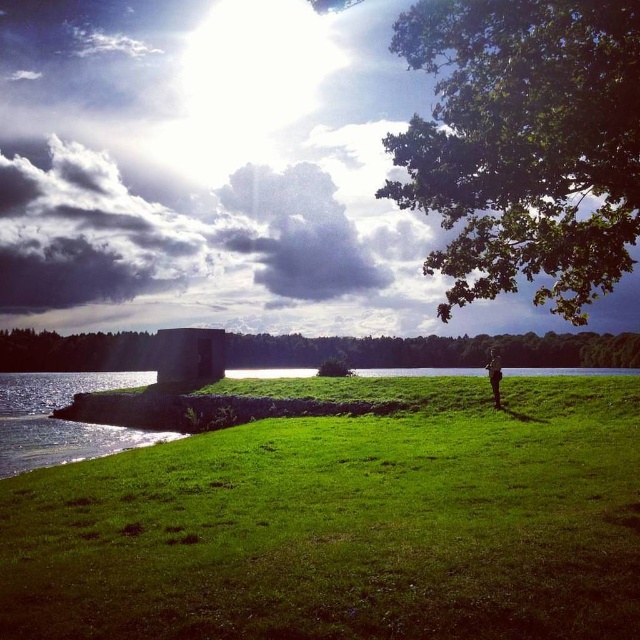
You are a photographer planning to take a landscape photo of the green grassy at center and the green leafy tree at upper right. Based on their heights, which object would you focus on first to ensure it appears larger in the photo?

The green leafy tree at upper right is taller than the green grassy at center, so focusing on it first would ensure it appears larger in the photo.

You are planning to take a photo of the green leafy tree at center and the green fabric jacket at center. Which object will appear larger in the photo?

The green leafy tree at center will appear larger in the photo because it is much taller than the green fabric jacket at center.